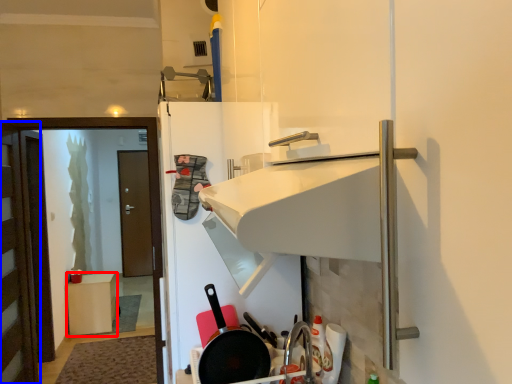
Question: Which object appears farthest to the camera in this image, furniture (highlighted by a red box) or door (highlighted by a blue box)?

Choices:
 (A) furniture
 (B) door

Answer: (A)